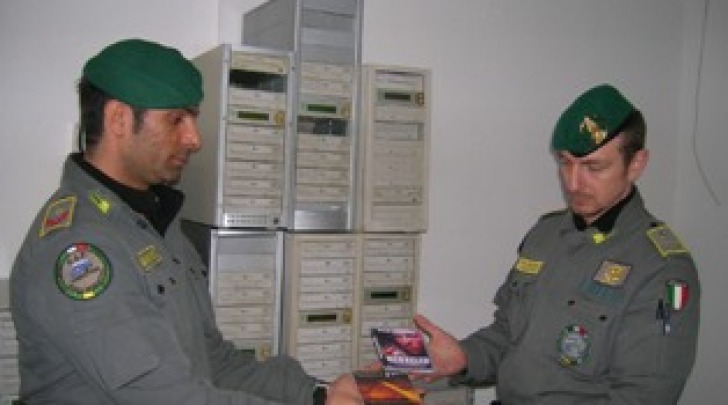
At what (x,y) coordinates should I click in order to perform the action: click on computer towers. Please return your answer as a coordinate pair (x, y). Looking at the image, I should click on pyautogui.click(x=245, y=186), pyautogui.click(x=314, y=176), pyautogui.click(x=375, y=176), pyautogui.click(x=373, y=281), pyautogui.click(x=325, y=279), pyautogui.click(x=266, y=277), pyautogui.click(x=6, y=331).